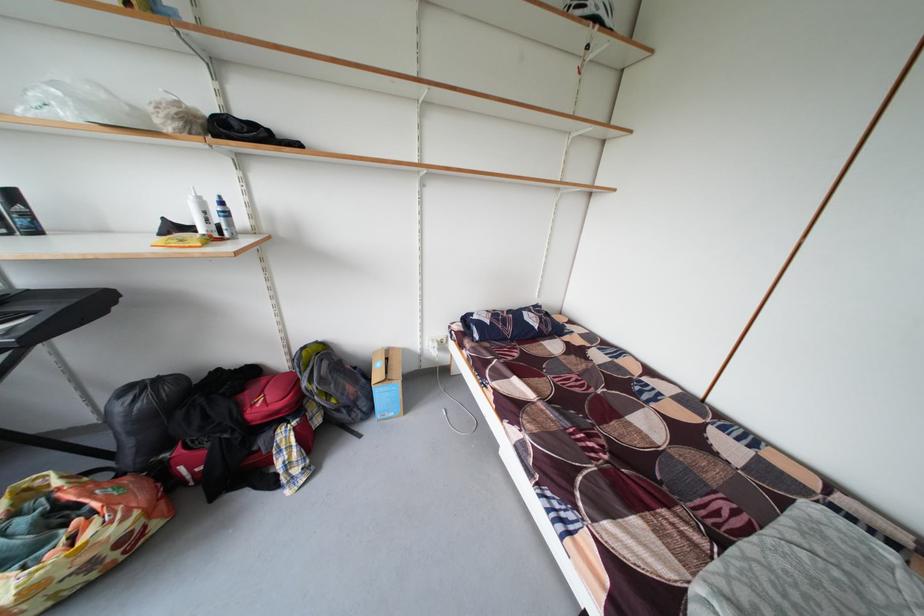
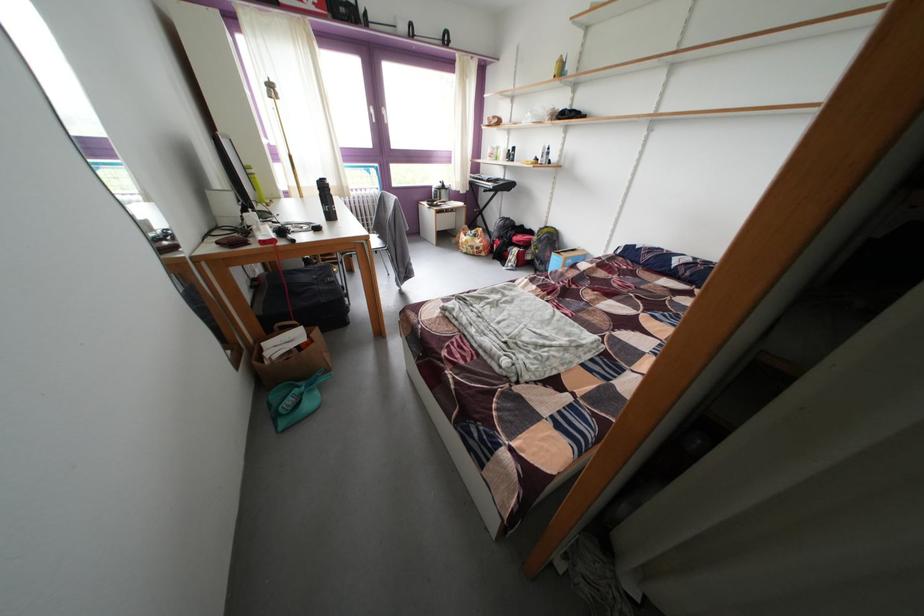
Where in the second image is the point corresponding to point 354,421 from the first image?

(548, 269)